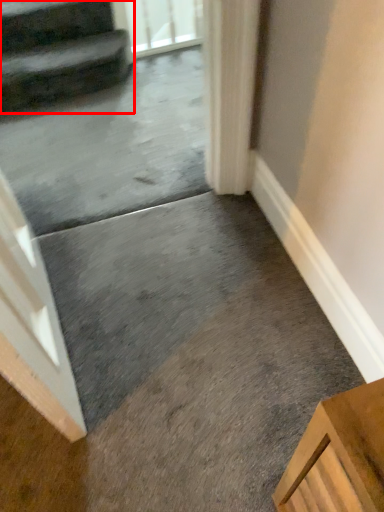
Question: Where is stairs (annotated by the red box) located in relation to screen door in the image?

Choices:
 (A) left
 (B) right

Answer: (A)